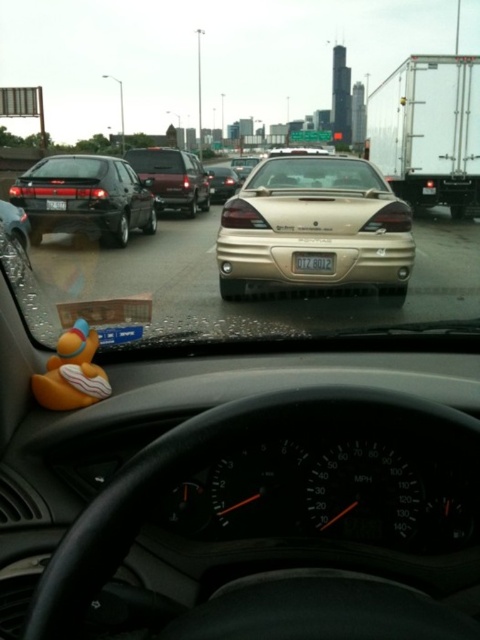
Is satin black sedan at left further to camera compared to gold metallic sedan at center?

No.

Which is in front, point (92, 236) or point (242, 157)?

Point (92, 236) is in front.

Locate an element on the screen. satin black sedan at left is located at coordinates (84, 196).

Can you confirm if satin black sedan at left is smaller than clear glass windshield at center?

No, satin black sedan at left is not smaller than clear glass windshield at center.

Describe the element at coordinates (84, 196) in the screenshot. The height and width of the screenshot is (640, 480). I see `satin black sedan at left` at that location.

Where is `satin black sedan at left`? satin black sedan at left is located at coordinates (84, 196).

Does satin gold sedan at center come behind gold metallic sedan at center?

No, satin gold sedan at center is closer to the viewer.

Between satin gold sedan at center and gold metallic sedan at center, which one has more height?

Standing taller between the two is gold metallic sedan at center.

Is point (220, 188) farther from viewer compared to point (231, 164)?

That is False.

Where is `satin gold sedan at center`? satin gold sedan at center is located at coordinates (222, 182).